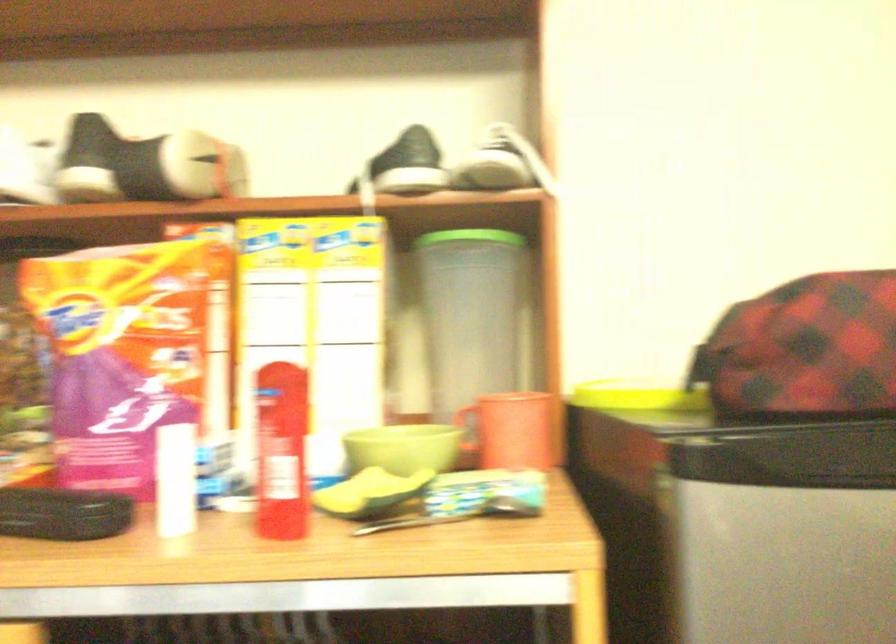
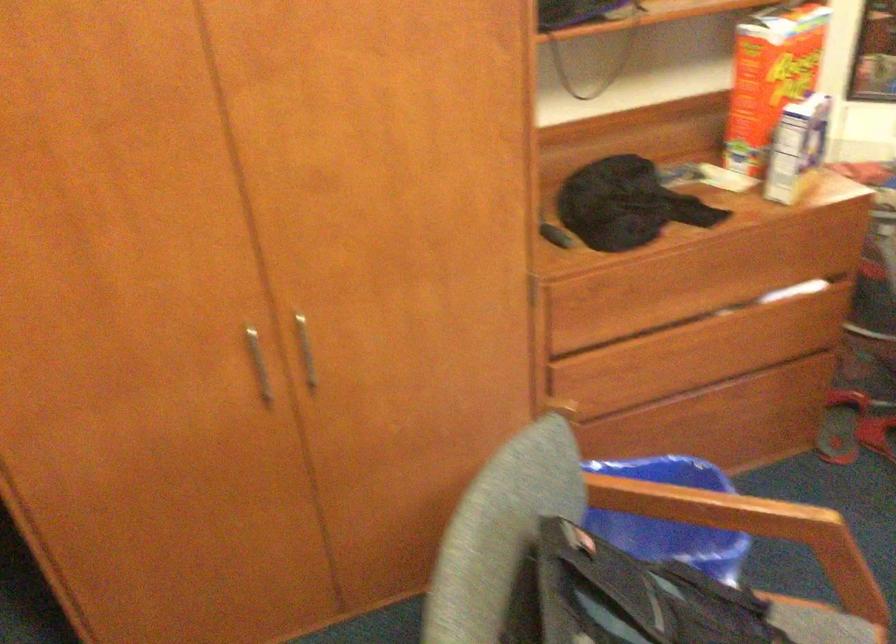
First-person continuous shooting, in which direction is the camera rotating?

The camera's rotation is toward right-down.